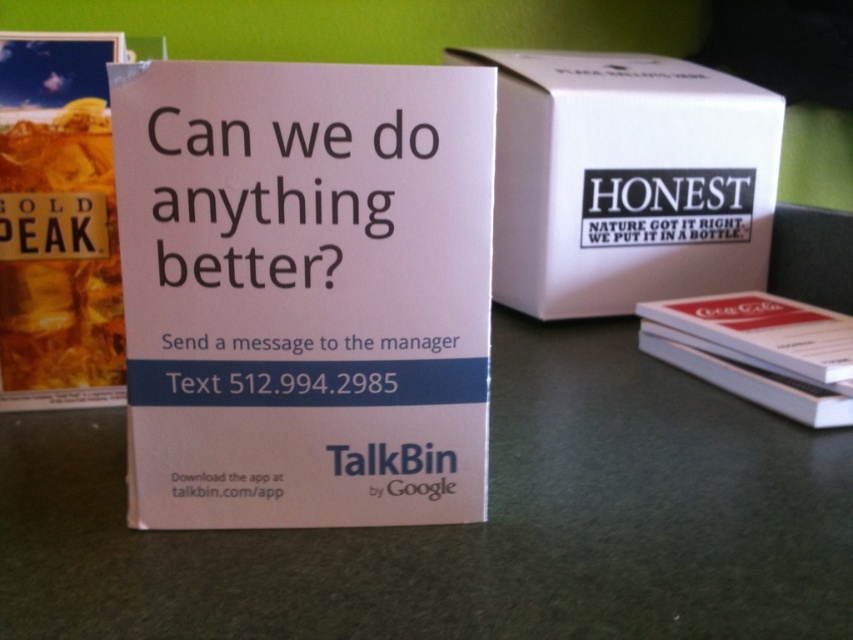
Who is lower down, white paperboard at center or white paper book at right?

white paper book at right

Which of these two, white paperboard at center or white paper book at right, stands taller?

white paperboard at center

Locate an element on the screen. white paperboard at center is located at coordinates (305, 291).

Which is above, white matte cardboard box at center or gold peak liquid at left?

white matte cardboard box at center

Is white matte cardboard box at center to the left of gold peak liquid at left from the viewer's perspective?

No, white matte cardboard box at center is not to the left of gold peak liquid at left.

Who is more distant from viewer, (602,243) or (56,266)?

Point (602,243)

Where is `white matte cardboard box at center`? This screenshot has height=640, width=853. white matte cardboard box at center is located at coordinates (625, 180).

Who is more distant from viewer, [294,372] or [550,294]?

Point [550,294]

Identify the location of white paperboard at center. (305, 291).